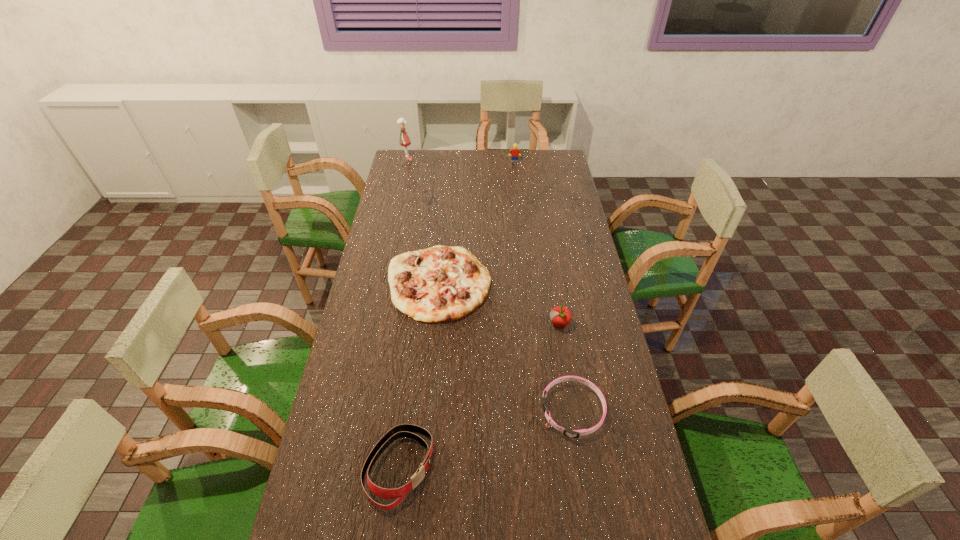
Find the location of a particular element. free space between the third shortest object and the right dog collar is located at coordinates (486, 440).

The image size is (960, 540). I want to click on unoccupied position between the pizza and the left dog collar, so click(419, 375).

This screenshot has height=540, width=960. Find the location of `vacant space that is in between the apple and the Lego`. vacant space that is in between the apple and the Lego is located at coordinates (537, 243).

Where is `vacant area that lies between the pizza and the doll`? Image resolution: width=960 pixels, height=540 pixels. vacant area that lies between the pizza and the doll is located at coordinates (423, 221).

Where is `free point between the Lego and the pizza`? free point between the Lego and the pizza is located at coordinates (477, 222).

Locate which object is the closest to the Lego. Please provide its 2D coordinates. Your answer should be formatted as a tuple, i.e. [(x, y)], where the tuple contains the x and y coordinates of a point satisfying the conditions above.

[(404, 140)]

Where is `object that is the fourth closest one to the left dog collar`? This screenshot has width=960, height=540. object that is the fourth closest one to the left dog collar is located at coordinates coord(404,140).

Image resolution: width=960 pixels, height=540 pixels. Identify the location of vacant space that satisfies the following two spatial constraints: 1. on the front-facing side of the Lego; 2. on the right side of the apple. (532, 325).

You are a GUI agent. You are given a task and a screenshot of the screen. Output one action in this format:
    pyautogui.click(x=<x>, y=<y>)
    Task: Click on the free space in the image that satisfies the following two spatial constraints: 1. on the front-facing side of the doll; 2. on the left side of the pizza
    This screenshot has height=540, width=960.
    Given the screenshot: What is the action you would take?
    pyautogui.click(x=379, y=282)

Find the location of a particular element. The height and width of the screenshot is (540, 960). vacant space that satisfies the following two spatial constraints: 1. on the front-facing side of the tallest object; 2. on the back side of the apple is located at coordinates (370, 325).